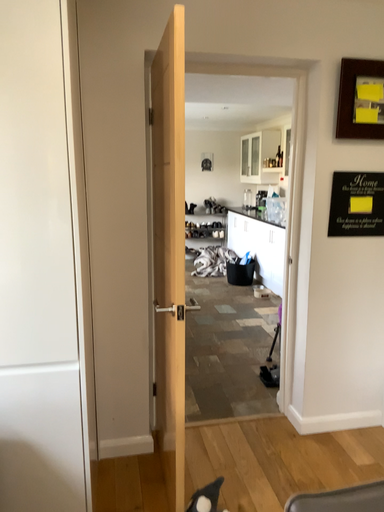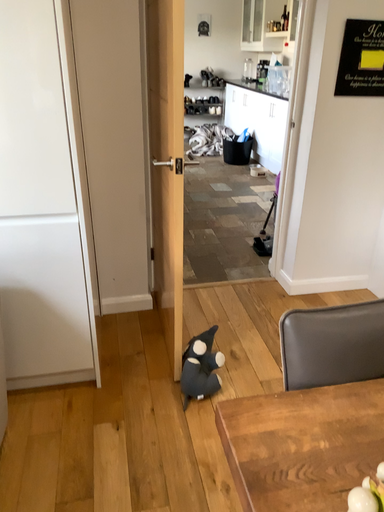
Question: Which way did the camera rotate in the video?

Choices:
 (A) rotated downward
 (B) rotated upward

Answer: (A)